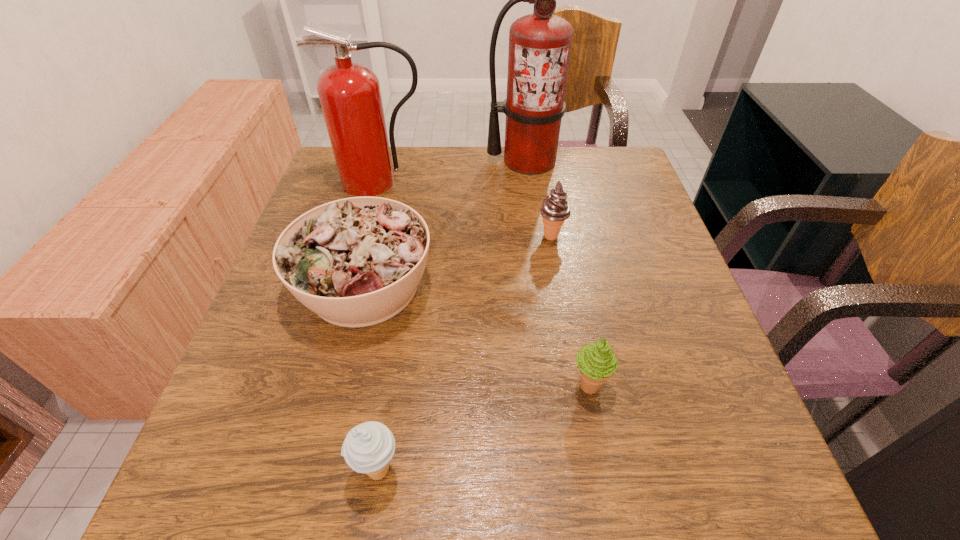
Where is `free point located with the handle and nozzle on the shorter fire extinguisher`? free point located with the handle and nozzle on the shorter fire extinguisher is located at coordinates [357, 268].

Locate an element on the screen. The image size is (960, 540). vacant space located on the front of the farthest icecream is located at coordinates (559, 277).

Find the location of a particular element. This screenshot has width=960, height=540. free space located on the right of the salad is located at coordinates (587, 286).

Locate an element on the screen. vacant position located 0.070m on the front of the second farthest icecream is located at coordinates (600, 445).

You are a GUI agent. You are given a task and a screenshot of the screen. Output one action in this format:
    pyautogui.click(x=<x>, y=<y>)
    Task: Click on the vacant space situated 0.330m on the right of the nearest icecream
    The image size is (960, 540).
    Given the screenshot: What is the action you would take?
    pyautogui.click(x=622, y=470)

At what (x,y) coordinates should I click in order to perform the action: click on object that is at the near edge. Please return your answer as a coordinate pair (x, y). Image resolution: width=960 pixels, height=540 pixels. Looking at the image, I should click on (368, 448).

Where is `fire extinguisher that is at the left edge`? This screenshot has width=960, height=540. fire extinguisher that is at the left edge is located at coordinates (350, 96).

I want to click on salad present at the left edge, so click(x=355, y=262).

Image resolution: width=960 pixels, height=540 pixels. Find the location of `object present at the far left corner`. object present at the far left corner is located at coordinates (350, 96).

You are a GUI agent. You are given a task and a screenshot of the screen. Output one action in this format:
    pyautogui.click(x=<x>, y=<y>)
    Task: Click on the free space at the far edge of the desktop
    The width and height of the screenshot is (960, 540).
    Given the screenshot: What is the action you would take?
    pyautogui.click(x=451, y=180)